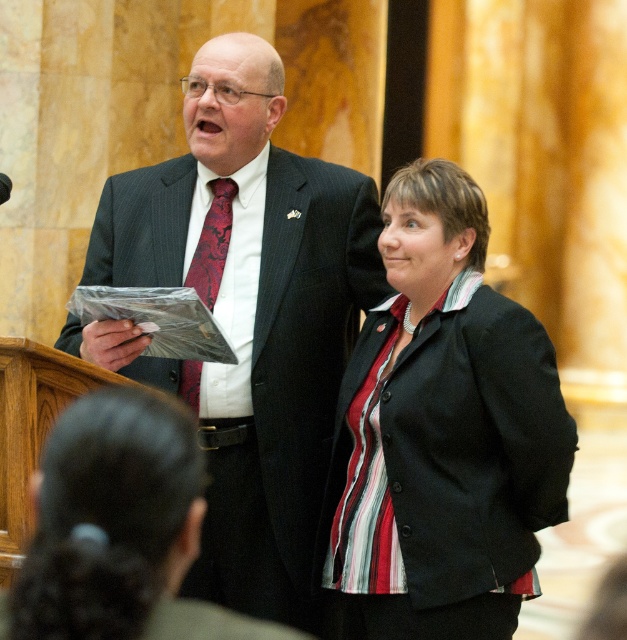
Question: Among these points, which one is nearest to the camera?

Choices:
 (A) (261, 512)
 (B) (206, 248)
 (C) (391, 346)

Answer: (C)

Question: Is matte black suit at center further to the viewer compared to striped fabric jacket at center?

Choices:
 (A) no
 (B) yes

Answer: (B)

Question: From the image, what is the correct spatial relationship of striped fabric jacket at center in relation to shiny silk tie at center?

Choices:
 (A) below
 (B) above

Answer: (A)

Question: Does striped fabric jacket at center have a lesser width compared to shiny silk tie at center?

Choices:
 (A) no
 (B) yes

Answer: (A)

Question: Which point is farther to the camera?

Choices:
 (A) (226, 250)
 (B) (290, 364)
 (C) (451, 456)

Answer: (A)

Question: Based on their relative distances, which object is nearer to the shiny silk tie at center?

Choices:
 (A) striped fabric jacket at center
 (B) matte black suit at center

Answer: (B)